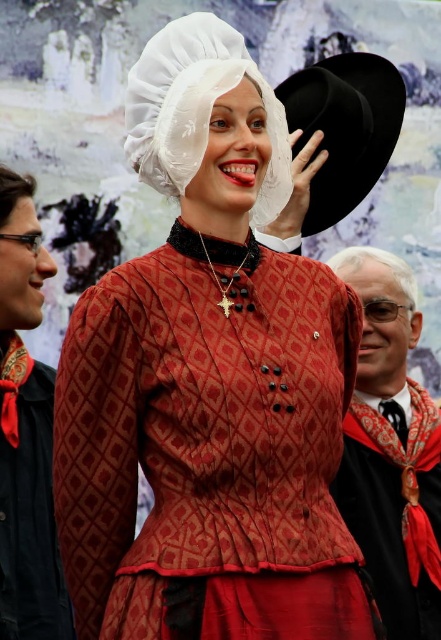
Locate an element on the screen. The height and width of the screenshot is (640, 441). white sheer bonnet at center is located at coordinates (197, 108).

Is white sheer bonnet at center taller than black felt hat at upper right?

In fact, white sheer bonnet at center may be shorter than black felt hat at upper right.

Is point (152, 58) more distant than point (332, 109)?

No, (152, 58) is in front of (332, 109).

I want to click on white sheer bonnet at center, so click(x=197, y=108).

Is point (347, 396) behind point (355, 70)?

No, (347, 396) is in front of (355, 70).

Is point (200, 576) farther from camera compared to point (287, 88)?

No, it is in front of (287, 88).

At what (x,y) coordinates should I click in order to perform the action: click on matte red dress at center. Please return your answer as a coordinate pair (x, y). Image resolution: width=441 pixels, height=640 pixels. Looking at the image, I should click on (209, 384).

Who is higher up, matte red dress at center or white sheer bonnet at center?

Positioned higher is white sheer bonnet at center.

Between matte red dress at center and white sheer bonnet at center, which one appears on the left side from the viewer's perspective?

white sheer bonnet at center

Who is more distant from viewer, (x=111, y=608) or (x=220, y=20)?

Positioned behind is point (x=220, y=20).

The image size is (441, 640). I want to click on matte red dress at center, so click(x=209, y=384).